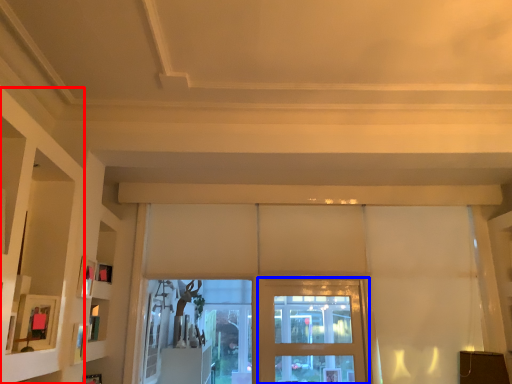
Question: Which object appears closest to the camera in this image, shelf (highlighted by a red box) or screen door (highlighted by a blue box)?

Choices:
 (A) shelf
 (B) screen door

Answer: (A)